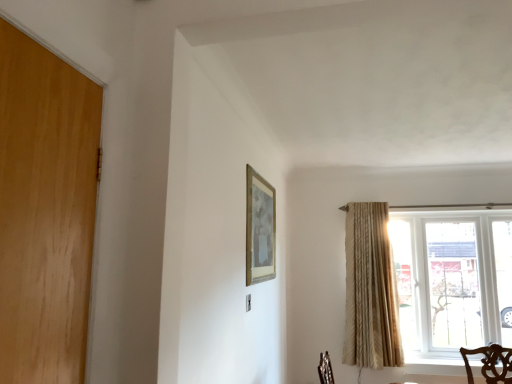
Question: Could you tell me if gold metallic picture frame at upper center is facing clear glass window at right?

Choices:
 (A) yes
 (B) no

Answer: (B)

Question: From a real-world perspective, is gold metallic picture frame at upper center physically above clear glass window at right?

Choices:
 (A) no
 (B) yes

Answer: (B)

Question: Is gold metallic picture frame at upper center bigger than clear glass window at right?

Choices:
 (A) yes
 (B) no

Answer: (B)

Question: Does gold metallic picture frame at upper center have a lesser width compared to clear glass window at right?

Choices:
 (A) yes
 (B) no

Answer: (A)

Question: Can clear glass window at right be found inside gold metallic picture frame at upper center?

Choices:
 (A) yes
 (B) no

Answer: (B)

Question: Is clear glass window at right at the back of gold metallic picture frame at upper center?

Choices:
 (A) no
 (B) yes

Answer: (A)

Question: Does beige textured curtain at right have a smaller size compared to gold metallic picture frame at upper center?

Choices:
 (A) no
 (B) yes

Answer: (A)

Question: Is beige textured curtain at right behind gold metallic picture frame at upper center?

Choices:
 (A) yes
 (B) no

Answer: (A)

Question: From a real-world perspective, is beige textured curtain at right on gold metallic picture frame at upper center?

Choices:
 (A) no
 (B) yes

Answer: (A)

Question: Can you confirm if beige textured curtain at right is wider than gold metallic picture frame at upper center?

Choices:
 (A) no
 (B) yes

Answer: (B)

Question: Is beige textured curtain at right far from gold metallic picture frame at upper center?

Choices:
 (A) no
 (B) yes

Answer: (B)

Question: Are beige textured curtain at right and gold metallic picture frame at upper center beside each other?

Choices:
 (A) yes
 (B) no

Answer: (B)

Question: Considering the relative sizes of gold metallic picture frame at upper center and beige textured curtain at right in the image provided, is gold metallic picture frame at upper center smaller than beige textured curtain at right?

Choices:
 (A) yes
 (B) no

Answer: (A)